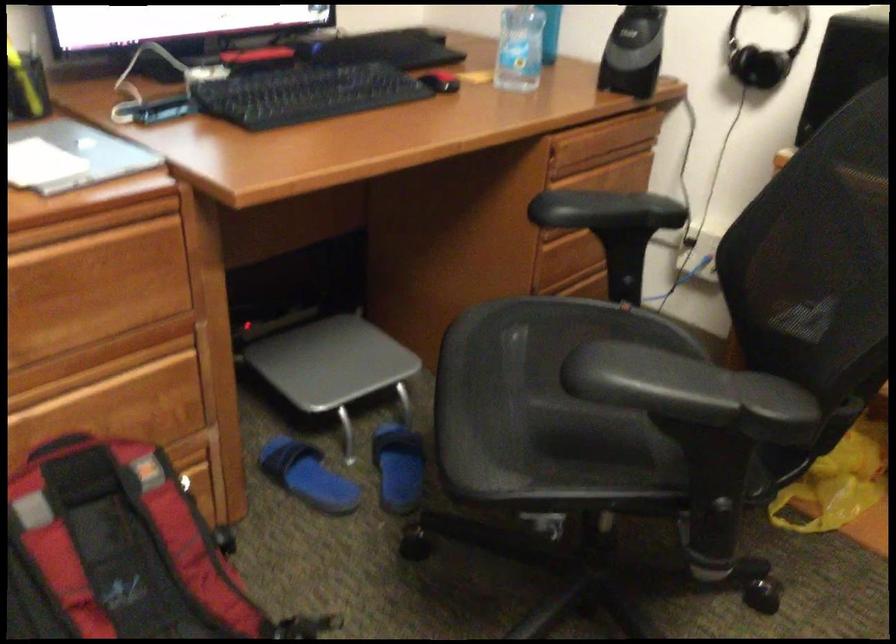
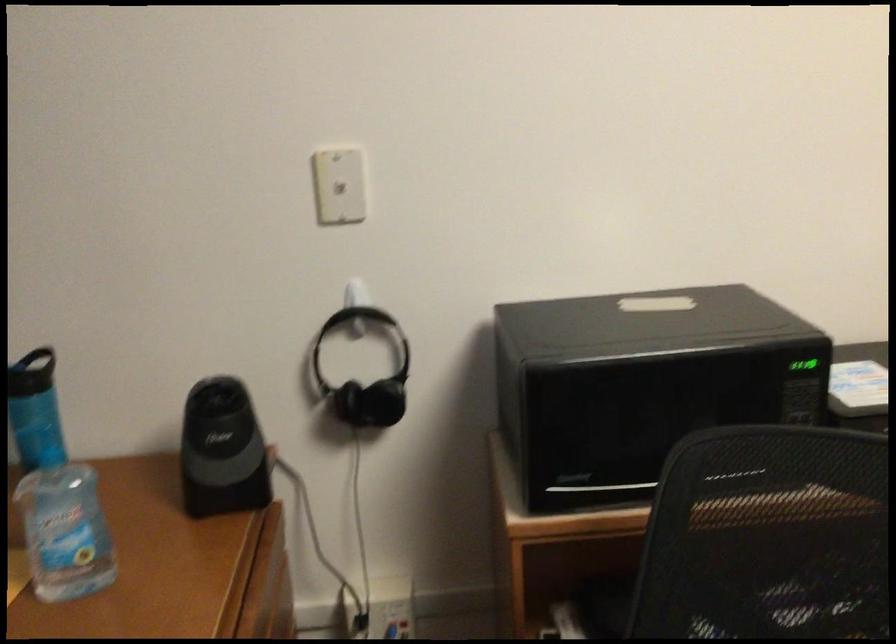
Question: The camera is either moving clockwise (left) or counter-clockwise (right) around the object. The first image is from the beginning of the video and the second image is from the end. Is the camera moving left or right when shooting the video?

Choices:
 (A) Left
 (B) Right

Answer: (A)